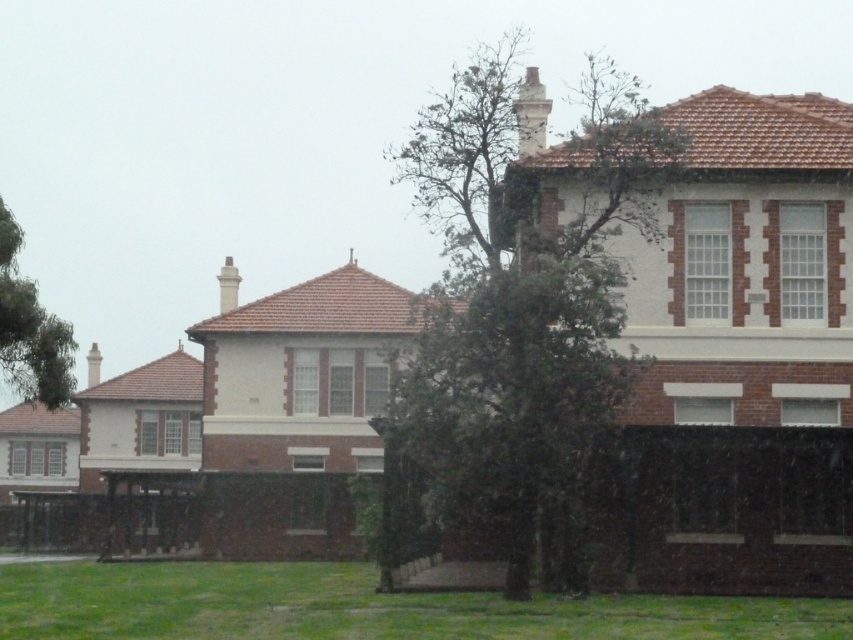
Question: Which point is farther to the camera?

Choices:
 (A) (21, 353)
 (B) (463, 637)

Answer: (A)

Question: From the image, what is the correct spatial relationship of green leafy tree at center in relation to green grass at lower center?

Choices:
 (A) below
 (B) above

Answer: (B)

Question: Which object is the closest to the green grass at lower center?

Choices:
 (A) green leafy tree at center
 (B) green leafy tree at upper left

Answer: (B)

Question: Does green leafy tree at center lie behind green leafy tree at upper left?

Choices:
 (A) no
 (B) yes

Answer: (A)

Question: Which of the following is the closest to the observer?

Choices:
 (A) green leafy tree at center
 (B) green leafy tree at upper left

Answer: (A)

Question: Can you confirm if green leafy tree at center is positioned to the right of green grass at lower center?

Choices:
 (A) yes
 (B) no

Answer: (A)